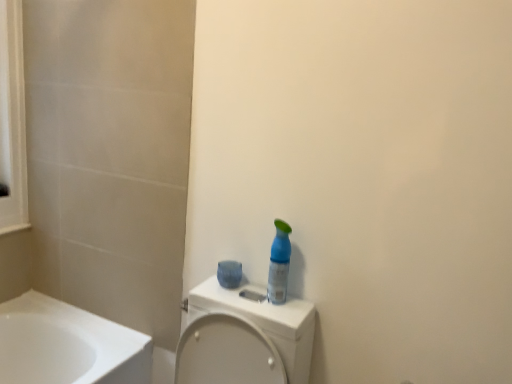
You are a GUI agent. You are given a task and a screenshot of the screen. Output one action in this format:
    pyautogui.click(x=<x>, y=<y>)
    Task: Click on the free space in front of transparent plastic spray bottle at center
    
    Given the screenshot: What is the action you would take?
    pyautogui.click(x=272, y=312)